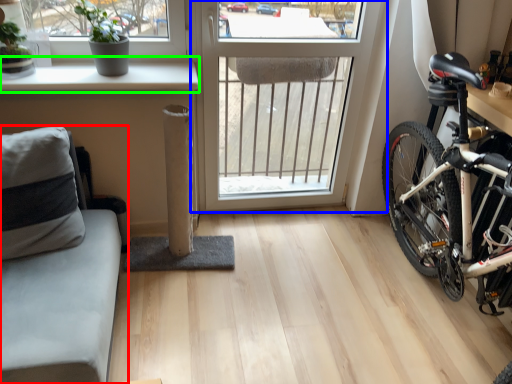
Question: Estimate the real-world distances between objects in this image. Which object is closer to studio couch (highlighted by a red box), window (highlighted by a blue box) or window sill (highlighted by a green box)?

Choices:
 (A) window
 (B) window sill

Answer: (B)